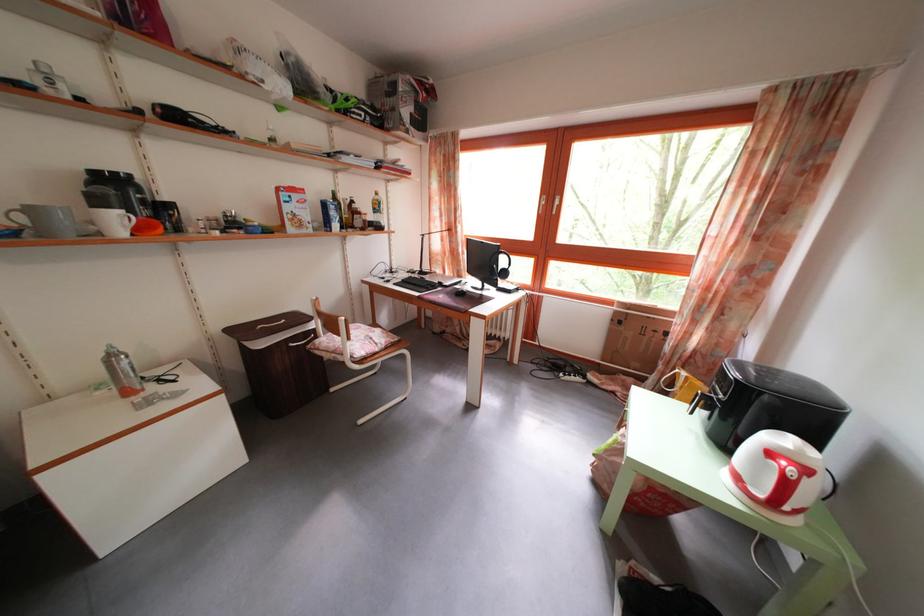
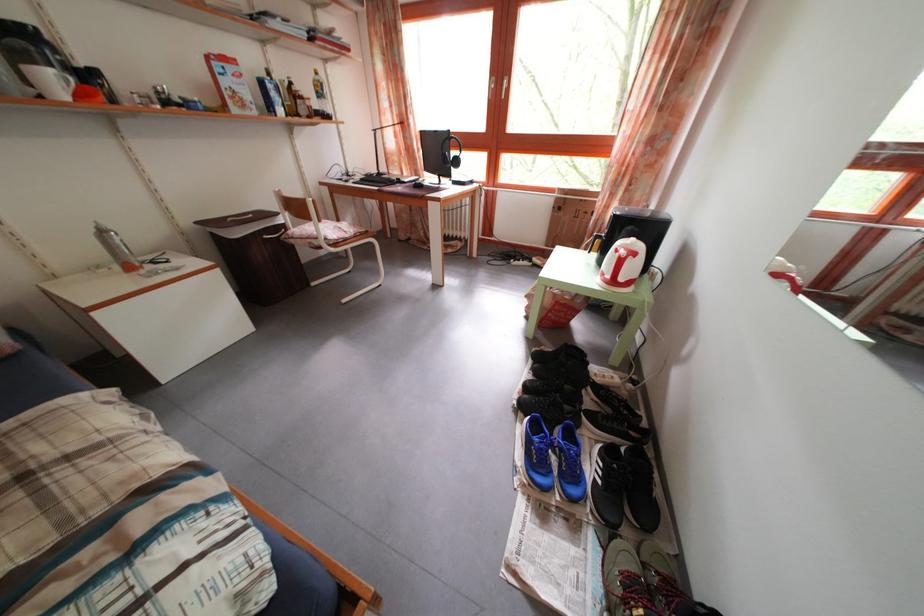
The point at (455, 281) is marked in the first image. Where is the corresponding point in the second image?

(412, 182)